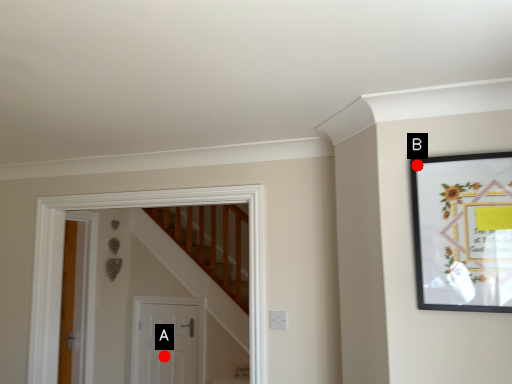
Question: Two points are circled on the image, labeled by A and B beside each circle. Which point is closer to the camera?

Choices:
 (A) A is closer
 (B) B is closer

Answer: (B)